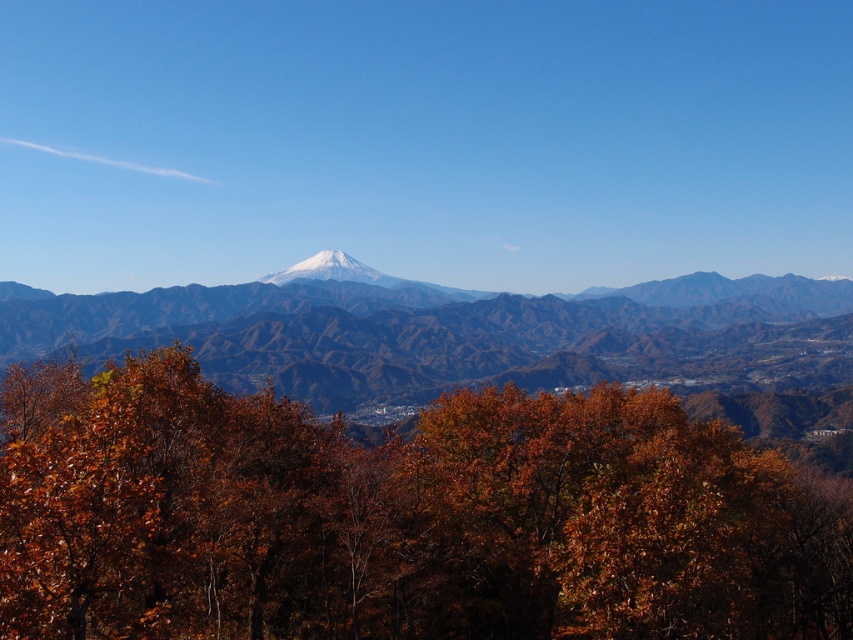
You are standing at the point marked by the coordinates (x=399, y=516) in the image. Based on the scene description, what object is directly beneath your feet?

The point at coordinates (x=399, y=516) is directly beneath the brown matte tree at center.